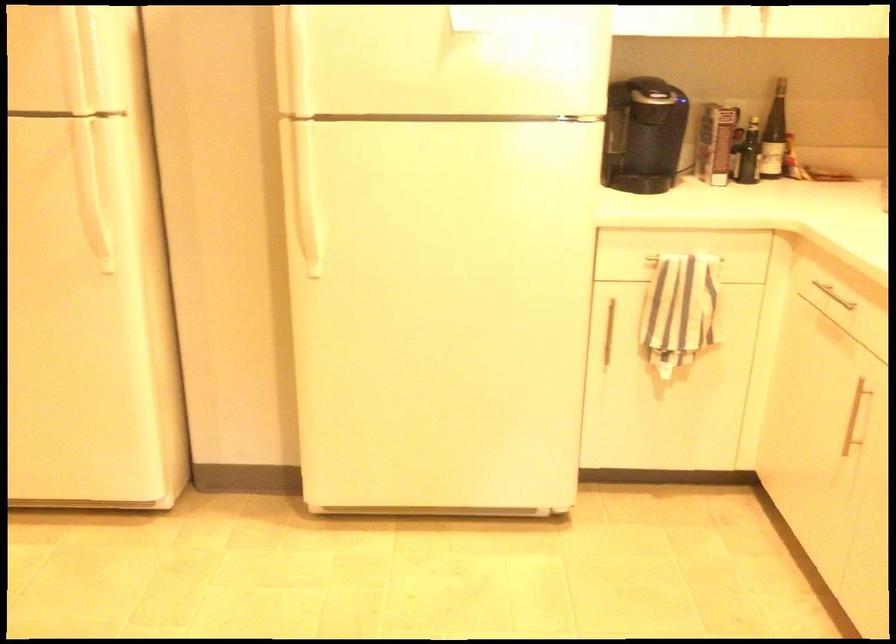
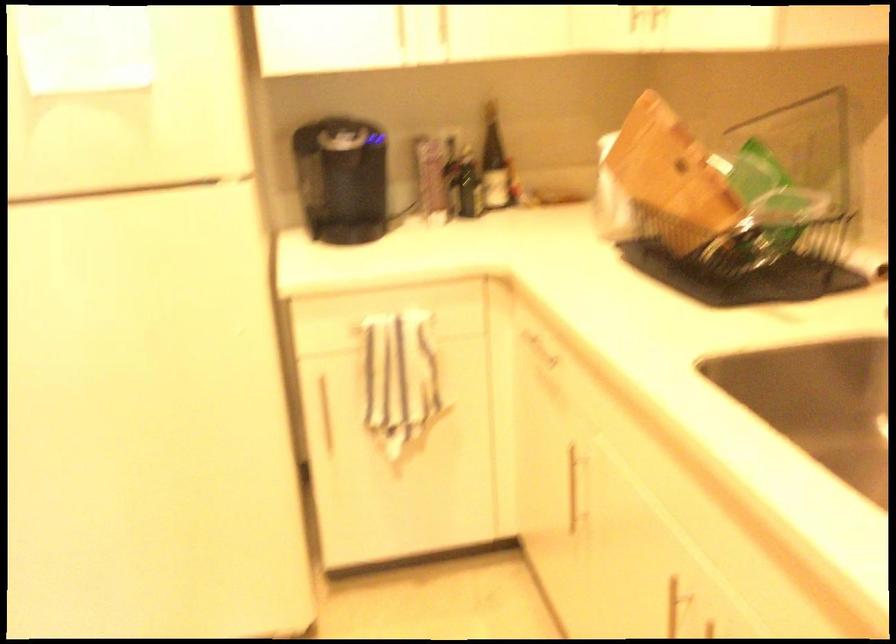
The images are taken continuously from a first-person perspective. In which direction are you moving?

The movement direction of the cameraman is right, forward.